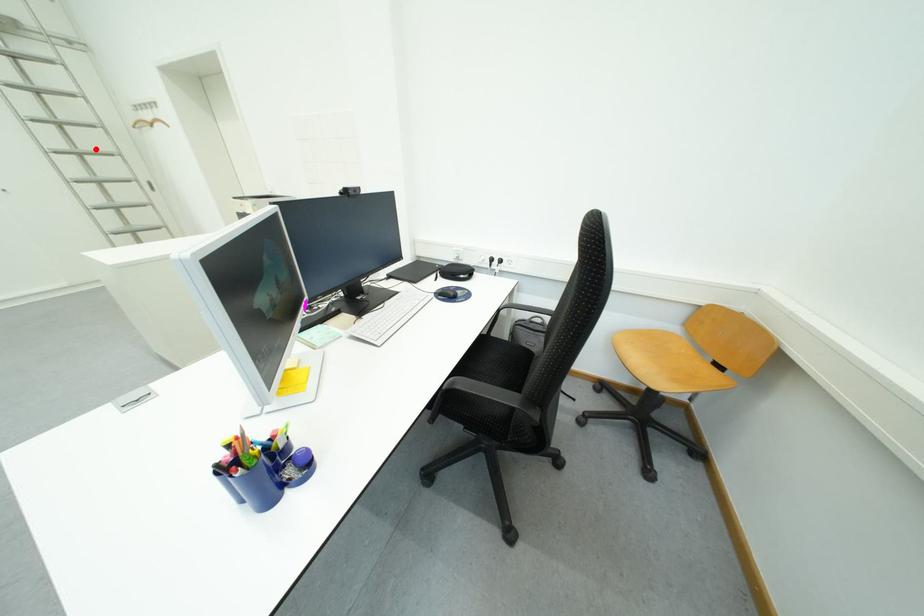
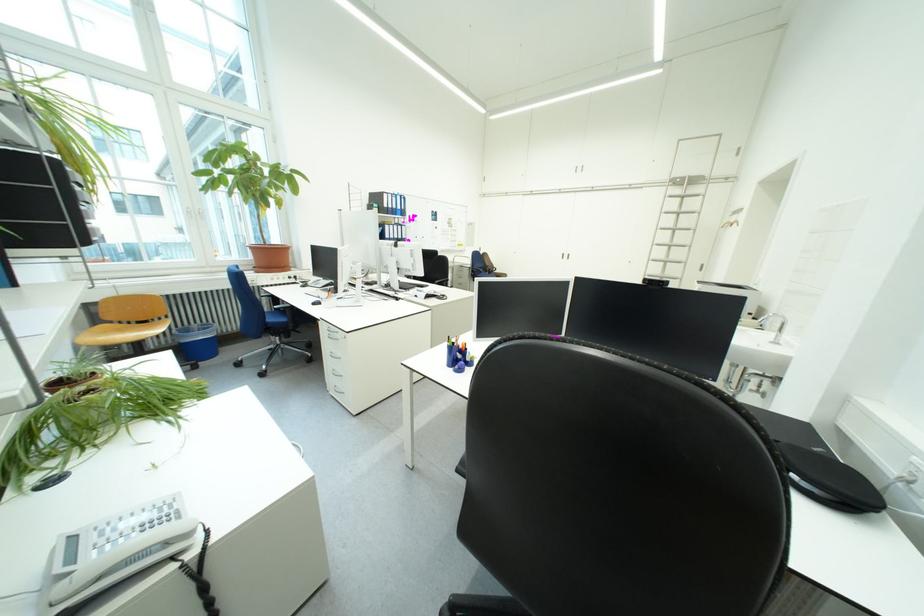
Question: A red point is marked in image1. In image2, is the corresponding 3D point closer to the camera or farther? Reply with the corresponding letter.

Choices:
 (A) The corresponding 3D point is closer.
 (B) The corresponding 3D point is farther.

Answer: (A)